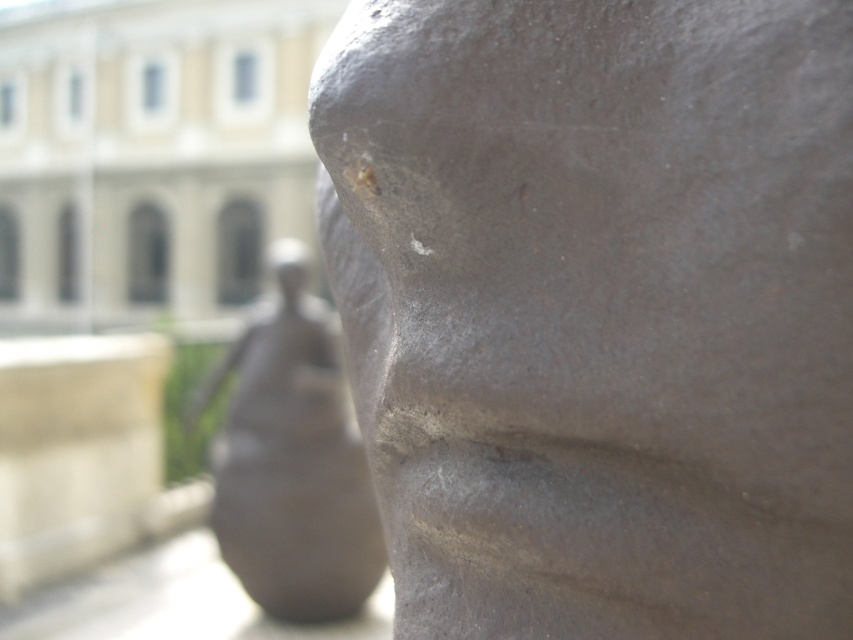
Question: Which object is farther from the camera taking this photo?

Choices:
 (A) matte bronze head at center
 (B) matte gray stone statue at center

Answer: (A)

Question: Is matte gray stone face at center above matte bronze head at center?

Choices:
 (A) no
 (B) yes

Answer: (A)

Question: Is matte gray stone face at center closer to the viewer compared to matte gray stone statue at center?

Choices:
 (A) no
 (B) yes

Answer: (B)

Question: Is matte gray stone face at center closer to camera compared to matte gray stone statue at center?

Choices:
 (A) no
 (B) yes

Answer: (B)

Question: Which point is closer to the camera?

Choices:
 (A) (752, 502)
 (B) (254, 445)
 (C) (285, 292)

Answer: (A)

Question: Which of the following is the closest to the observer?

Choices:
 (A) (279, 308)
 (B) (456, 422)

Answer: (B)